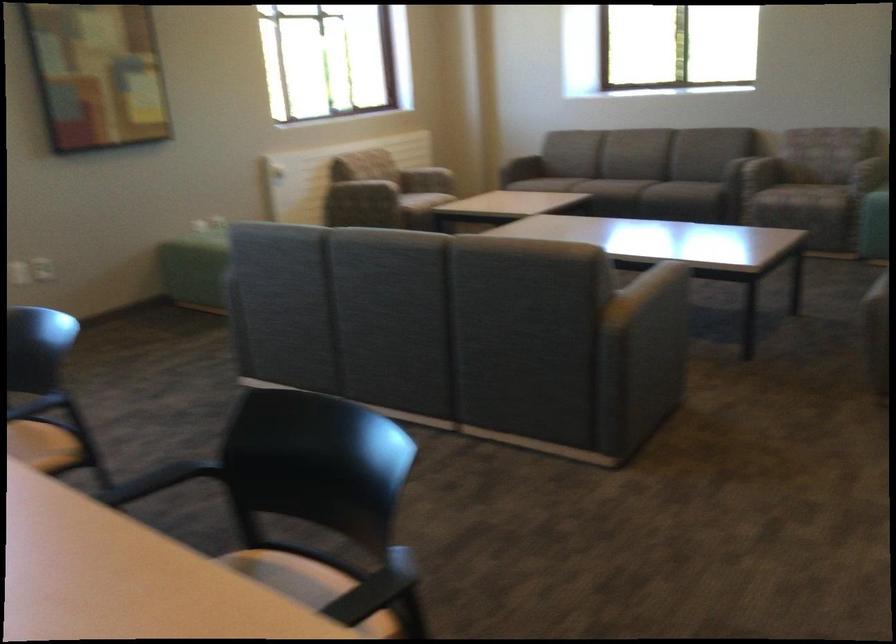
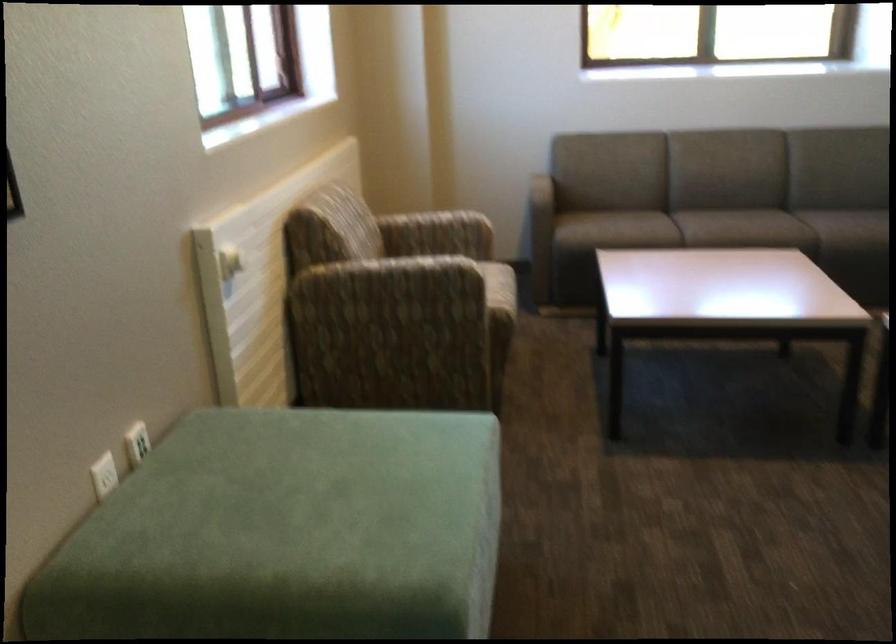
Find the pixel in the second image that matches (268,164) in the first image.

(229, 263)